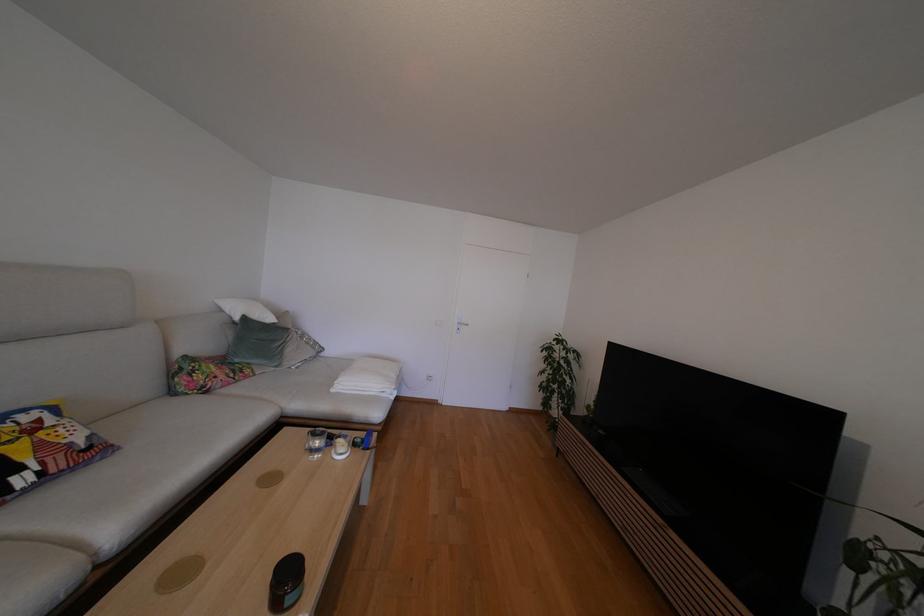
The image size is (924, 616). I want to click on silver door handle, so click(459, 323).